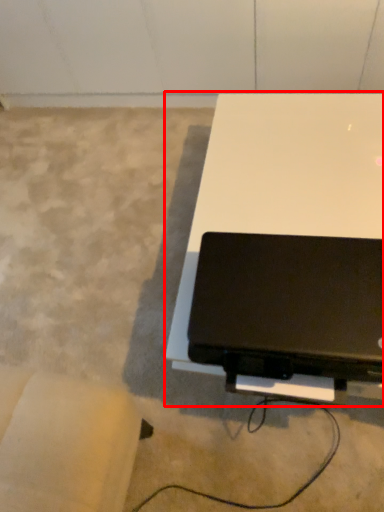
Question: From the image's perspective, where is table (annotated by the red box) located in relation to laptop in the image?

Choices:
 (A) below
 (B) above

Answer: (B)